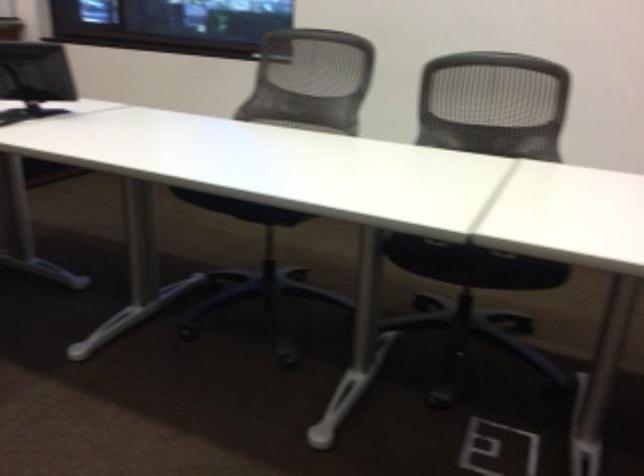
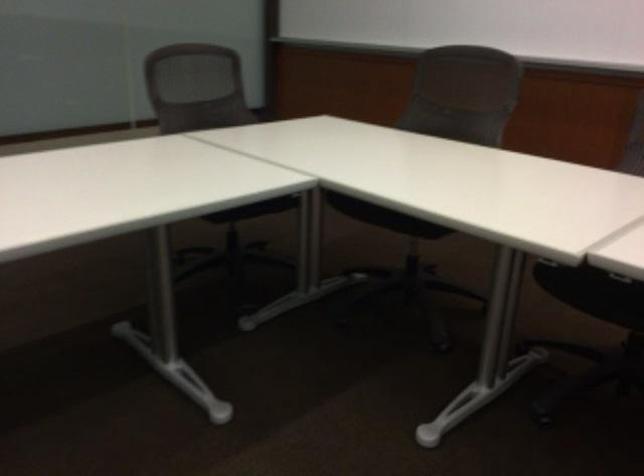
The images are taken continuously from a first-person perspective. In which direction is your viewpoint rotating?

The rotation direction of the camera is left-down.